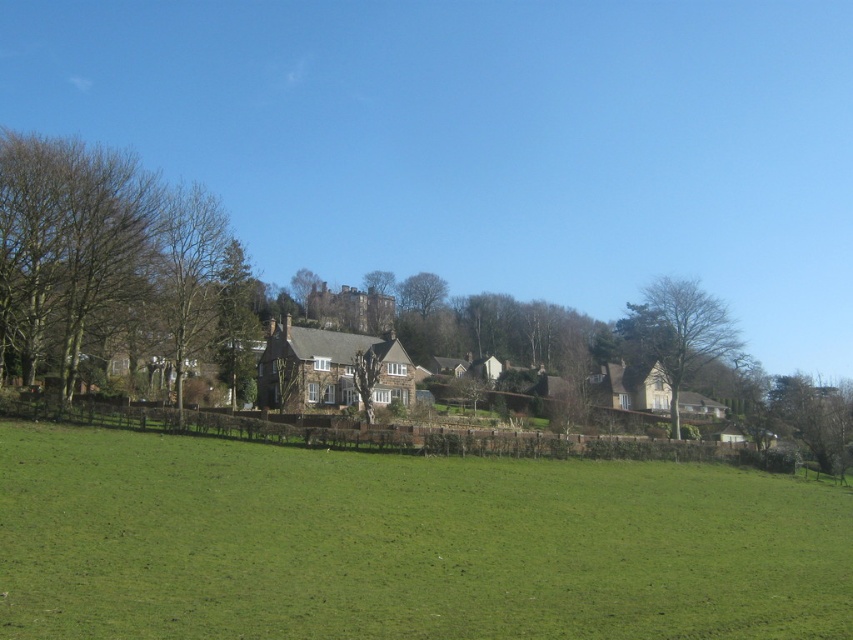
You are planning to plant a new tree in your backyard. You have two options from the image, the green leafy tree at center and the green leafy tree at lower right. Which tree has a narrower width, making it suitable for a smaller garden space?

The green leafy tree at center has a narrower width compared to the green leafy tree at lower right, making it suitable for a smaller garden space.

You are standing in the rural landscape and want to take a photo of both the green grass at center and the brown leafless tree at left. Which object should you focus on first to ensure both are in clear view?

You should focus on the green grass at center first since it is closer to the viewer than the brown leafless tree at left, ensuring both will be in clear view when focused on the closer object.